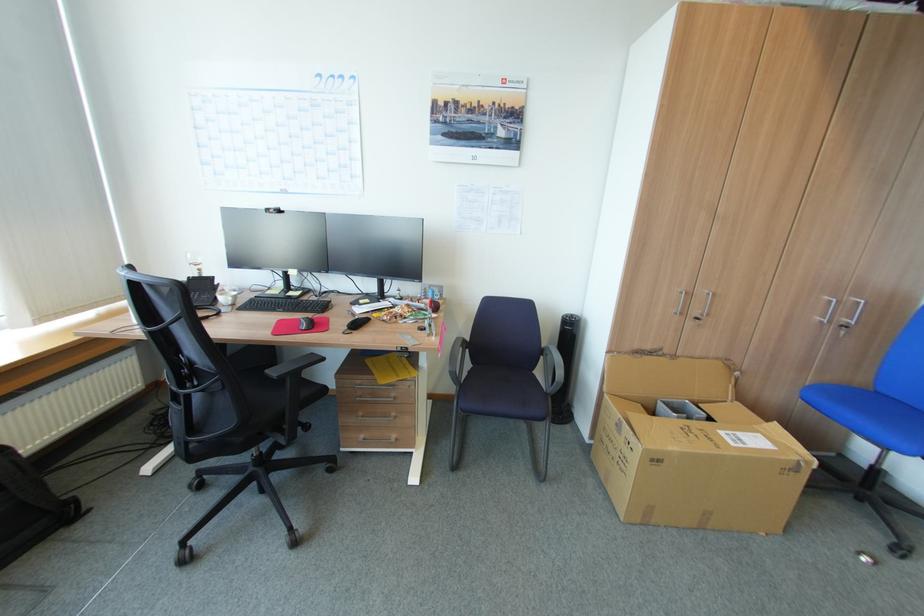
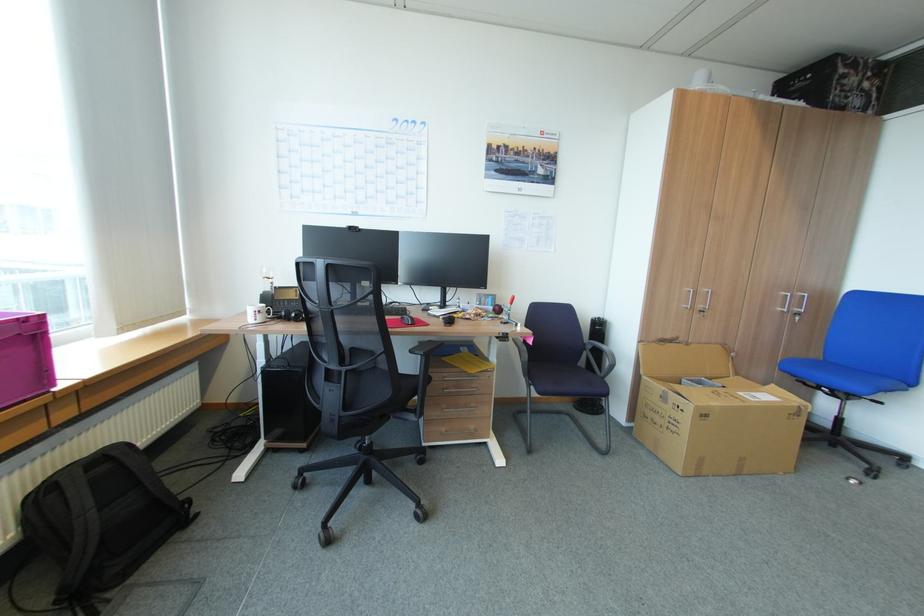
The point at (772, 421) is marked in the first image. Where is the corresponding point in the second image?

(771, 384)